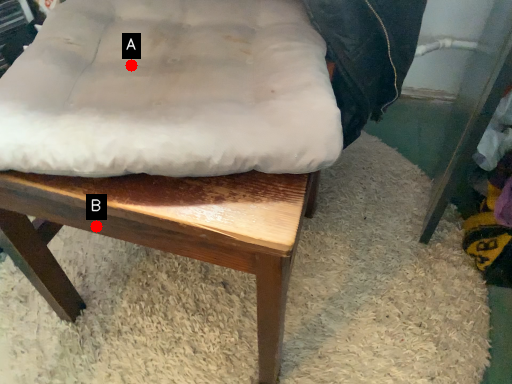
Question: Two points are circled on the image, labeled by A and B beside each circle. Which point appears farthest from the camera in this image?

Choices:
 (A) A is further
 (B) B is further

Answer: (A)